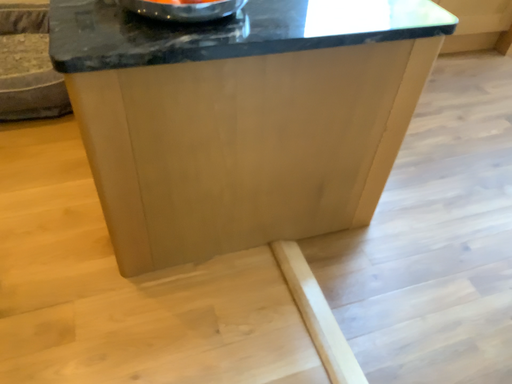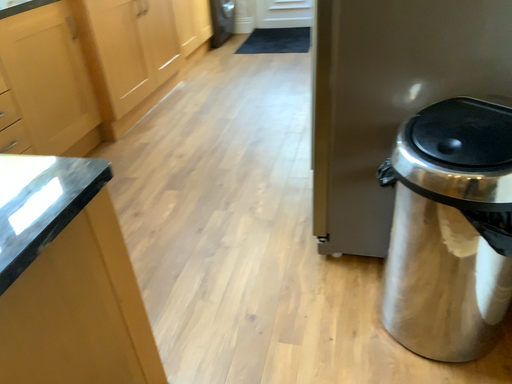
Question: How did the camera likely rotate when shooting the video?

Choices:
 (A) rotated upward
 (B) rotated downward

Answer: (A)